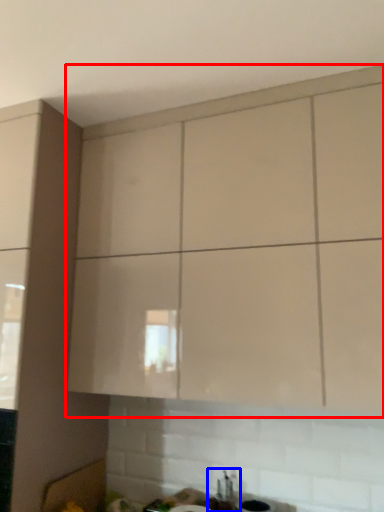
Question: Which object is closer to the camera taking this photo, cabinetry (highlighted by a red box) or sink (highlighted by a blue box)?

Choices:
 (A) cabinetry
 (B) sink

Answer: (A)